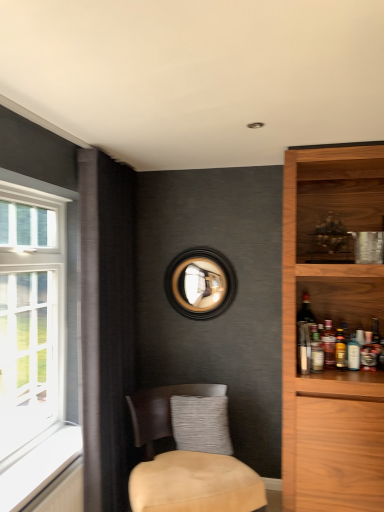
Question: Is gray textured pillow at center smaller than translucent glass bottle at shelf right, the fourth beverage from the left?

Choices:
 (A) yes
 (B) no

Answer: (B)

Question: Considering the relative sizes of gray textured pillow at center and translucent glass bottle at shelf right, the first beverage positioned from the right, in the image provided, is gray textured pillow at center bigger than translucent glass bottle at shelf right, the first beverage positioned from the right,?

Choices:
 (A) no
 (B) yes

Answer: (B)

Question: Can you confirm if gray textured pillow at center is shorter than translucent glass bottle at shelf right, the fourth beverage from the left?

Choices:
 (A) yes
 (B) no

Answer: (B)

Question: Is gray textured pillow at center looking in the opposite direction of translucent glass bottle at shelf right, the first beverage positioned from the right?

Choices:
 (A) yes
 (B) no

Answer: (B)

Question: Are gray textured pillow at center and translucent glass bottle at shelf right, the first beverage positioned from the right, making contact?

Choices:
 (A) no
 (B) yes

Answer: (A)

Question: Is gray textured pillow at center positioned beyond the bounds of translucent glass bottle at shelf right, the first beverage positioned from the right?

Choices:
 (A) no
 (B) yes

Answer: (B)

Question: Is black wood picture frame at center wider than beige fabric chair at lower center?

Choices:
 (A) yes
 (B) no

Answer: (B)

Question: Does black wood picture frame at center appear on the right side of beige fabric chair at lower center?

Choices:
 (A) no
 (B) yes

Answer: (B)

Question: From a real-world perspective, is black wood picture frame at center on top of beige fabric chair at lower center?

Choices:
 (A) yes
 (B) no

Answer: (A)

Question: Considering the relative positions of black wood picture frame at center and beige fabric chair at lower center in the image provided, is black wood picture frame at center to the left of beige fabric chair at lower center from the viewer's perspective?

Choices:
 (A) yes
 (B) no

Answer: (B)

Question: Is black wood picture frame at center further to camera compared to beige fabric chair at lower center?

Choices:
 (A) no
 (B) yes

Answer: (B)

Question: Does black wood picture frame at center turn towards beige fabric chair at lower center?

Choices:
 (A) no
 (B) yes

Answer: (A)

Question: Is translucent glass bottle at shelf right, acting as the 3th beverage starting from the right, facing towards translucent glass bottle at shelf right, the first beverage positioned from the right?

Choices:
 (A) yes
 (B) no

Answer: (B)